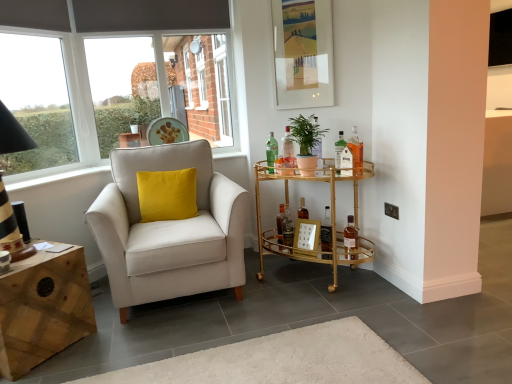
Question: Is gold mirrored bar cart at center right further to the viewer compared to matte white armchair at left?

Choices:
 (A) yes
 (B) no

Answer: (A)

Question: Can you confirm if gold mirrored bar cart at center right is bigger than matte white armchair at left?

Choices:
 (A) no
 (B) yes

Answer: (A)

Question: Is gold mirrored bar cart at center right positioned before matte white armchair at left?

Choices:
 (A) no
 (B) yes

Answer: (A)

Question: From the image's perspective, is gold mirrored bar cart at center right below matte white armchair at left?

Choices:
 (A) no
 (B) yes

Answer: (B)

Question: Is gold mirrored bar cart at center right to the left of matte white armchair at left from the viewer's perspective?

Choices:
 (A) no
 (B) yes

Answer: (A)

Question: Does point (350, 216) appear closer or farther from the camera than point (61, 109)?

Choices:
 (A) closer
 (B) farther

Answer: (A)

Question: From the image's perspective, is brown glass bottle at center, the 8th bottle from the left, above or below transparent glass window at upper left?

Choices:
 (A) below
 (B) above

Answer: (A)

Question: Considering the positions of brown glass bottle at center, the 1th bottle when ordered from right to left, and transparent glass window at upper left in the image, is brown glass bottle at center, the 1th bottle when ordered from right to left, bigger or smaller than transparent glass window at upper left?

Choices:
 (A) big
 (B) small

Answer: (B)

Question: Which is correct: brown glass bottle at center, the 1th bottle when ordered from right to left, is inside transparent glass window at upper left, or outside of it?

Choices:
 (A) inside
 (B) outside

Answer: (B)

Question: In terms of width, does brown glass bottle at center, the 8th bottle from the left, look wider or thinner when compared to black plastic power outlet at upper right?

Choices:
 (A) wide
 (B) thin

Answer: (A)

Question: Is brown glass bottle at center, the 8th bottle from the left, to the left or to the right of black plastic power outlet at upper right in the image?

Choices:
 (A) left
 (B) right

Answer: (A)

Question: Is point (348, 226) positioned closer to the camera than point (388, 211)?

Choices:
 (A) closer
 (B) farther

Answer: (B)

Question: From the image's perspective, is brown glass bottle at center, the 1th bottle when ordered from right to left, above or below black plastic power outlet at upper right?

Choices:
 (A) below
 (B) above

Answer: (A)

Question: Visually, is transparent glass window at upper left positioned to the left or to the right of green glass bottle at center, arranged as the 8th bottle when viewed from the right?

Choices:
 (A) right
 (B) left

Answer: (B)

Question: Based on their sizes in the image, would you say transparent glass window at upper left is bigger or smaller than green glass bottle at center, the 1th bottle from the left?

Choices:
 (A) big
 (B) small

Answer: (A)